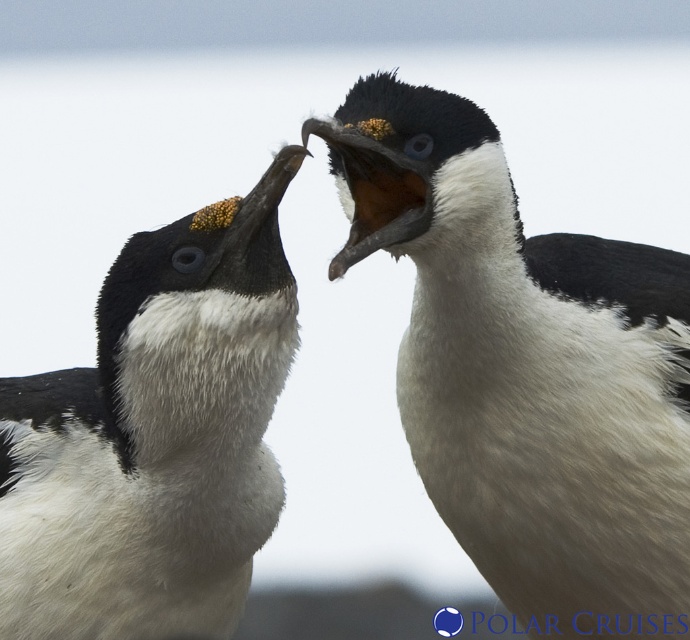
You are a wildlife photographer aiming to capture a closeup of the white fluffy penguin at left and the white soft feathers at center. Your camera has a maximum focus range of 40 centimeters. Can you take a photo of both subjects without moving your camera?

The white soft feathers at center are 40.08 centimeters away from the white fluffy penguin at left. Since the distance between them is slightly over 40 centimeters, the camera cannot focus on both subjects simultaneously within the 40 cm range. You would need to adjust your position or use a different camera setting to capture both in focus.

You are a wildlife photographer trying to capture a closeup shot of the white fluffy penguin at left and the white soft feathers at center. Which object is larger in the frame?

The white soft feathers at center is bigger than the white fluffy penguin at left, so the white soft feathers at center will appear larger in the frame.

You are a photographer trying to capture a close shot of the white fluffy penguin at left while avoiding the white soft feathers at center. Can you focus on the penguin without the feathers blocking the view?

The white soft feathers at center is positioned over white fluffy penguin at left, so the feathers are blocking the view of the penguin. You cannot focus on the penguin without the feathers blocking the view.